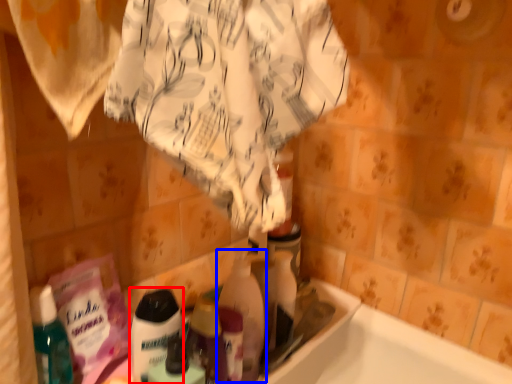
Question: Among these objects, which one is nearest to the camera, cleaning product (highlighted by a red box) or cleaning product (highlighted by a blue box)?

Choices:
 (A) cleaning product
 (B) cleaning product

Answer: (A)